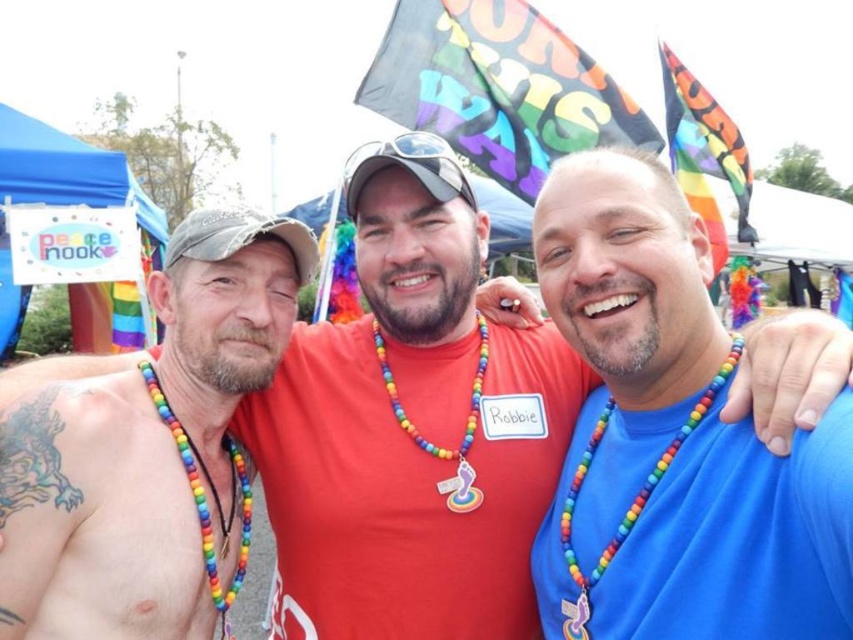
Question: Which point is closer to the camera taking this photo?

Choices:
 (A) (485, 353)
 (B) (108, 620)
 (C) (207, 550)
 (D) (709, 362)

Answer: (D)

Question: From the image, what is the correct spatial relationship of blue skin at upper left in relation to rainbow beaded necklace at center?

Choices:
 (A) below
 (B) above

Answer: (A)

Question: Is blue skin at upper left bigger than rainbow beads necklace at center?

Choices:
 (A) no
 (B) yes

Answer: (B)

Question: Which point appears closest to the camera in this image?

Choices:
 (A) (227, 596)
 (B) (445, 449)
 (C) (570, 621)

Answer: (C)

Question: Which point appears closest to the camera in this image?

Choices:
 (A) (165, 384)
 (B) (148, 390)

Answer: (B)

Question: Does blue matte shirt at center appear under rainbow beaded necklace at left?

Choices:
 (A) yes
 (B) no

Answer: (B)